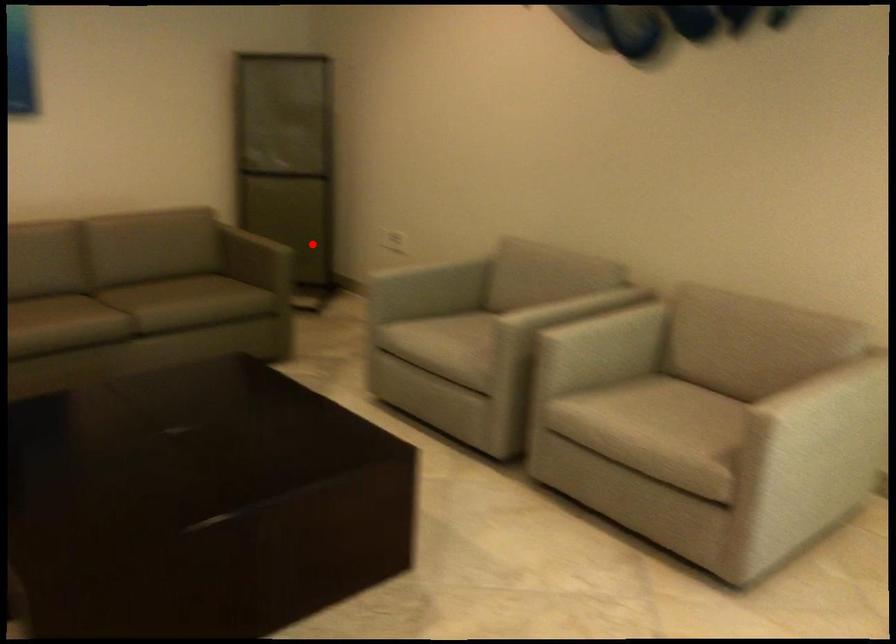
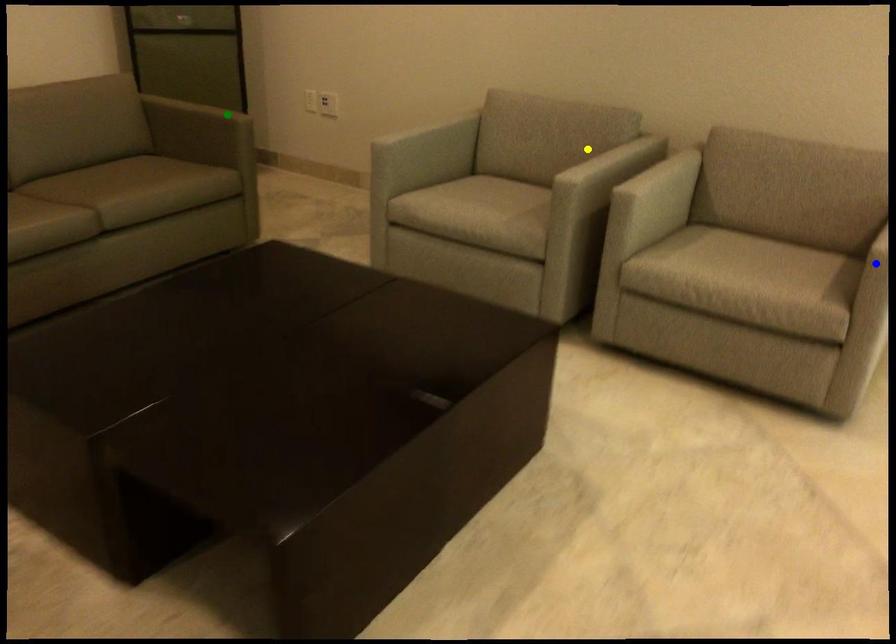
Question: I am providing you with two images of the same scene from different viewpoints. A red point is marked on the first image. You are given multiple points on the second image. Which mark in image 2 goes with the point in image 1?

Choices:
 (A) blue point
 (B) yellow point
 (C) green point

Answer: (C)